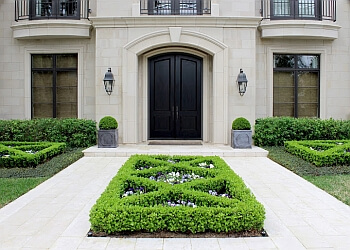
Where is `windows`? windows is located at coordinates (307, 80), (289, 78), (67, 85), (41, 65), (41, 86), (62, 61), (286, 63), (309, 58).